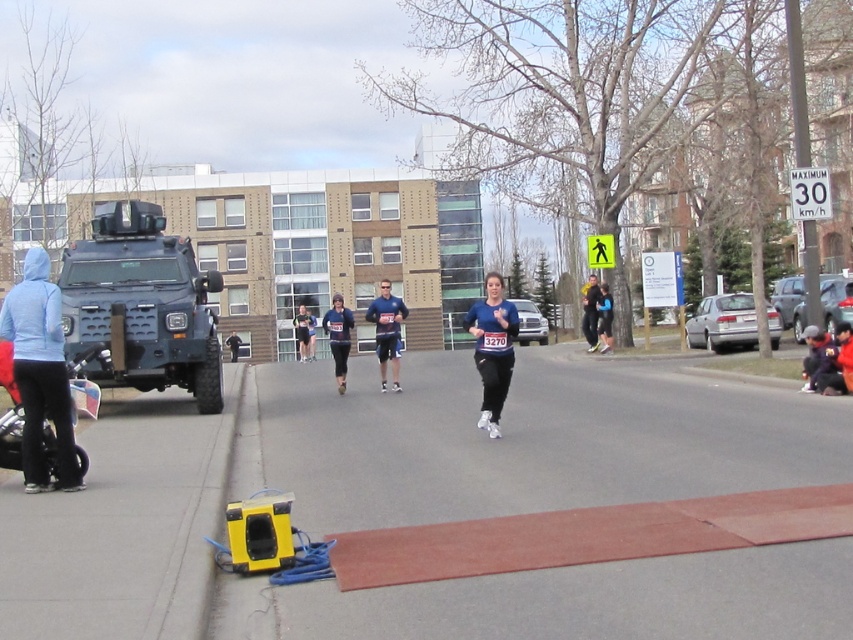
Question: Can you confirm if dark blue fabric running suit at center is bigger than dark blue fabric jacket at center?

Choices:
 (A) no
 (B) yes

Answer: (B)

Question: Does matte blue shirt at center come behind purple fleece jacket at lower right?

Choices:
 (A) no
 (B) yes

Answer: (B)

Question: Which point is closer to the camera?

Choices:
 (A) blue fabric running suit at center
 (B) blue fabric shirt at center

Answer: (B)

Question: Which point is closer to the camera?

Choices:
 (A) (612, 589)
 (B) (383, 380)
 (C) (16, 300)

Answer: (A)

Question: Is matte blue shirt at center closer to camera compared to dark blue jacket at center?

Choices:
 (A) no
 (B) yes

Answer: (B)

Question: Estimate the real-world distances between objects in this image. Which object is closer to the dark blue fabric jacket at center?

Choices:
 (A) yellow plastic at lower left
 (B) dark blue fabric at center

Answer: (B)